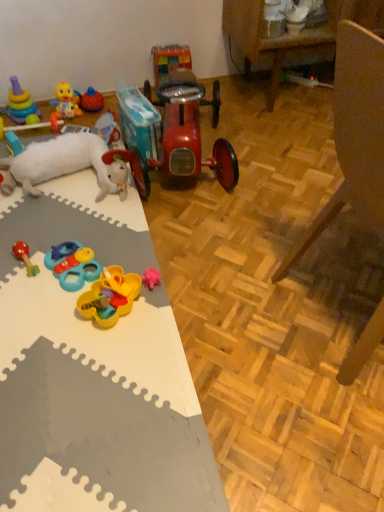
Locate an element on the screen. The width and height of the screenshot is (384, 512). free location to the right of shiny red car at center, which is the first toy in right-to-left order is located at coordinates (276, 157).